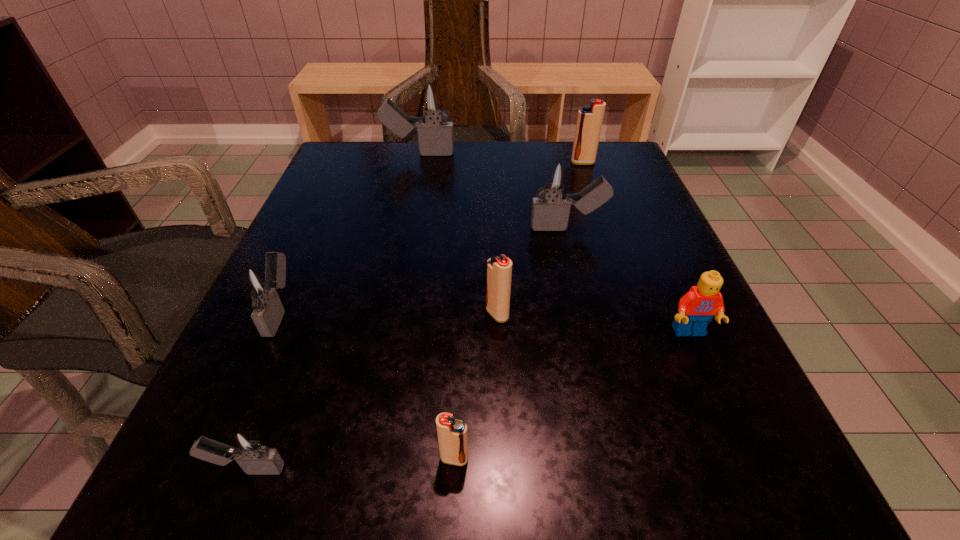
Locate an element on the screen. This screenshot has width=960, height=540. free spot located on the right of the smallest gray igniter is located at coordinates (626, 469).

The image size is (960, 540). I want to click on Lego that is positioned at the right edge, so click(x=697, y=307).

This screenshot has width=960, height=540. In order to click on object at the far left corner in this screenshot , I will do `click(432, 100)`.

At what (x,y) coordinates should I click in order to perform the action: click on object located in the near left corner section of the desktop. Please return your answer as a coordinate pair (x, y). This screenshot has height=540, width=960. Looking at the image, I should click on (246, 445).

Where is `object at the far right corner`? The image size is (960, 540). object at the far right corner is located at coordinates (589, 122).

This screenshot has width=960, height=540. I want to click on vacant space at the far edge, so click(x=459, y=157).

At what (x,y) coordinates should I click in order to perform the action: click on vacant area at the near edge. Please return your answer as a coordinate pair (x, y). Looking at the image, I should click on (341, 468).

This screenshot has height=540, width=960. Find the location of `free region at the left edge of the desktop`. free region at the left edge of the desktop is located at coordinates pos(375,224).

Locate an element on the screen. The height and width of the screenshot is (540, 960). vacant space at the right edge of the desktop is located at coordinates (712, 340).

In the image, there is a desktop. Where is `free space at the far left corner`? This screenshot has height=540, width=960. free space at the far left corner is located at coordinates (403, 143).